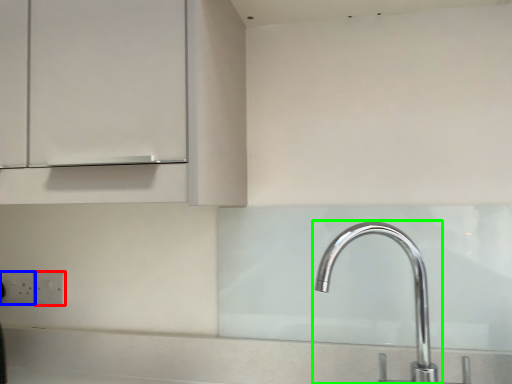
Question: Which object is positioned closest to electric outlet (highlighted by a red box)? Select from electric outlet (highlighted by a blue box) and tap (highlighted by a green box).

Choices:
 (A) electric outlet
 (B) tap

Answer: (A)